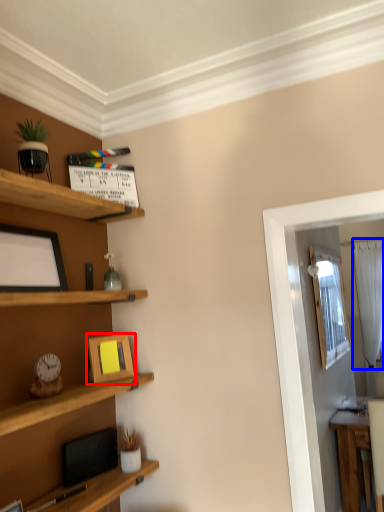
Question: Which object appears closest to the camera in this image, picture frame (highlighted by a red box) or curtain (highlighted by a blue box)?

Choices:
 (A) picture frame
 (B) curtain

Answer: (A)